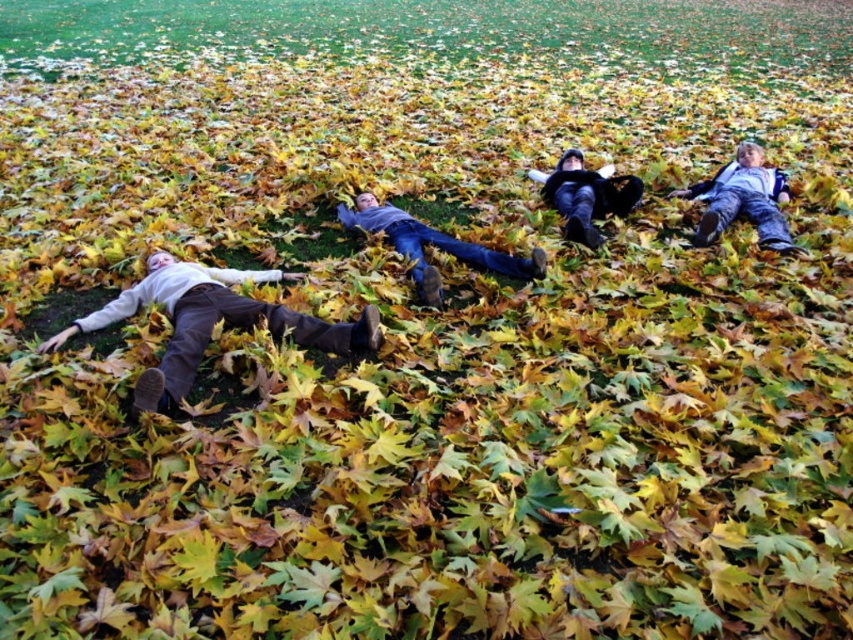
You are standing at the origin point of the coordinate system in the image. You want to walk to the green grass at upper center. What are the coordinates you need to move to?

The coordinates to reach the green grass at upper center are at point [432,29].

You are planning to place a 1.2 meter long blanket between the matte gray sweater at left and the gray sweater at center. Will the blanket cover both of them completely?

The distance between the matte gray sweater at left and the gray sweater at center is 1.09 meters. Since the blanket is 1.2 meters long, it is longer than the distance between them. Therefore, the blanket can cover both the matte gray sweater at left and the gray sweater at center completely.

You are organizing a group photo and need to arrange the matte gray sweater at left and the gray sweater at center in a row. Based on their sizes, which should be placed on the left side to maintain a size descending order from left to right?

The matte gray sweater at left should be placed on the left side since it is wider than the gray sweater at center, ensuring the size decreases from left to right.